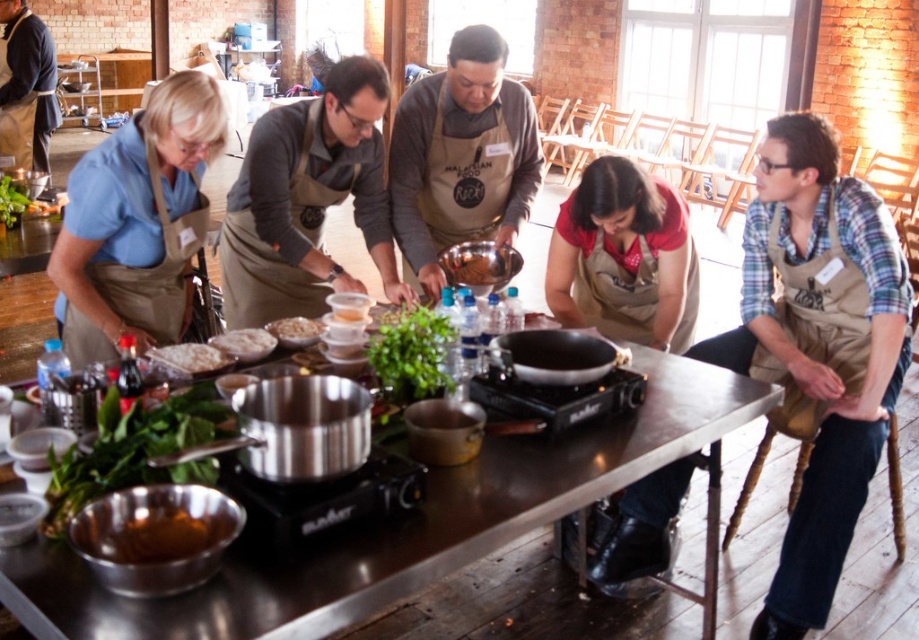
Can you confirm if dark blue shirt at upper left is positioned below brown matte bowl at center?

No, dark blue shirt at upper left is not below brown matte bowl at center.

Between point (21, 6) and point (448, 272), which one is positioned in front?

Point (448, 272) is in front.

What do you see at coordinates (26, 86) in the screenshot?
I see `dark blue shirt at upper left` at bounding box center [26, 86].

Identify the location of dark blue shirt at upper left. The image size is (919, 640). (26, 86).

Does point (63, 337) come farther from viewer compared to point (231, 358)?

Yes.

Can you confirm if light blue shirt at left is bigger than white powdery flour at center?

Indeed, light blue shirt at left has a larger size compared to white powdery flour at center.

Who is more distant from viewer, [65,241] or [166,365]?

The point [65,241] is behind.

Locate an element on the screen. The image size is (919, 640). light blue shirt at left is located at coordinates (137, 221).

Does plaid cotton shirt at center appear over brown matte bowl at lower left?

Yes, plaid cotton shirt at center is above brown matte bowl at lower left.

Which is in front, point (781, 548) or point (182, 515)?

Point (182, 515) is more forward.

Is point (778, 125) closer to camera compared to point (152, 524)?

No, (778, 125) is further to viewer.

You are a GUI agent. You are given a task and a screenshot of the screen. Output one action in this format:
    pyautogui.click(x=<x>, y=<y>)
    Task: Click on the plaid cotton shirt at center
    The width and height of the screenshot is (919, 640).
    Given the screenshot: What is the action you would take?
    pyautogui.click(x=819, y=346)